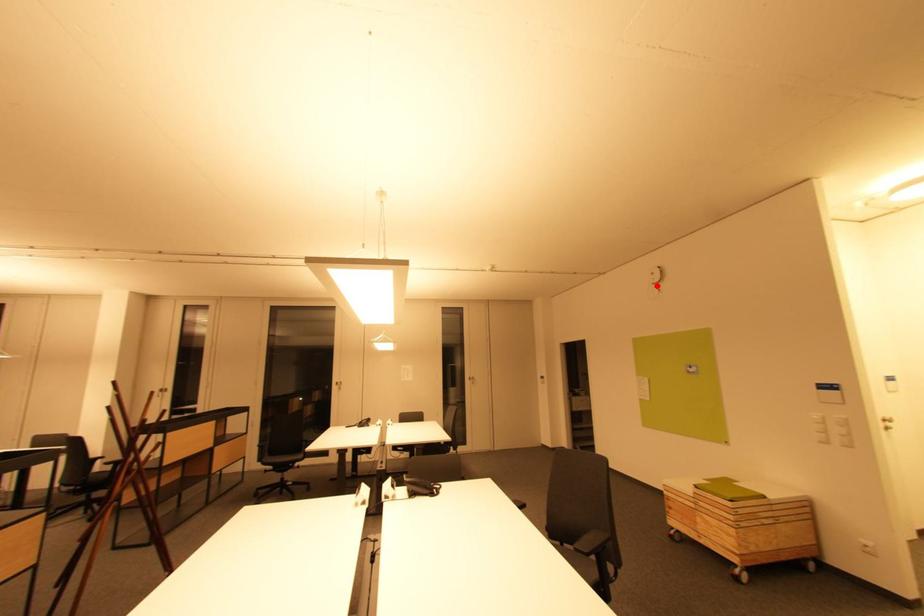
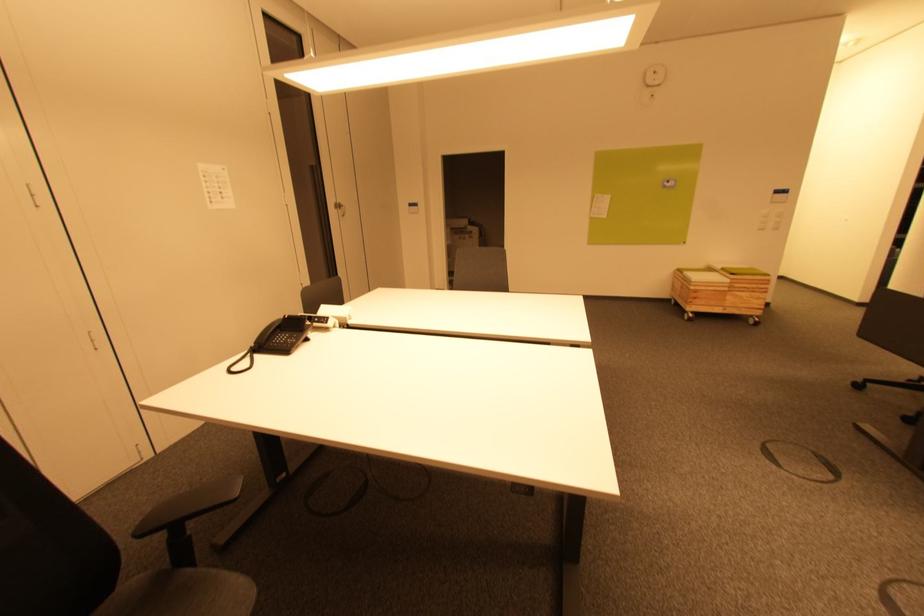
The point at the highlighted location is marked in the first image. Where is the corresponding point in the second image?

(652, 87)